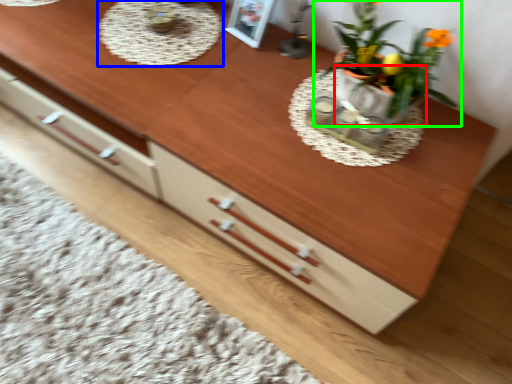
Question: Based on their relative distances, which object is nearer to flowerpot (highlighted by a red box)? Choose from round table (highlighted by a blue box) and houseplant (highlighted by a green box).

Choices:
 (A) round table
 (B) houseplant

Answer: (B)